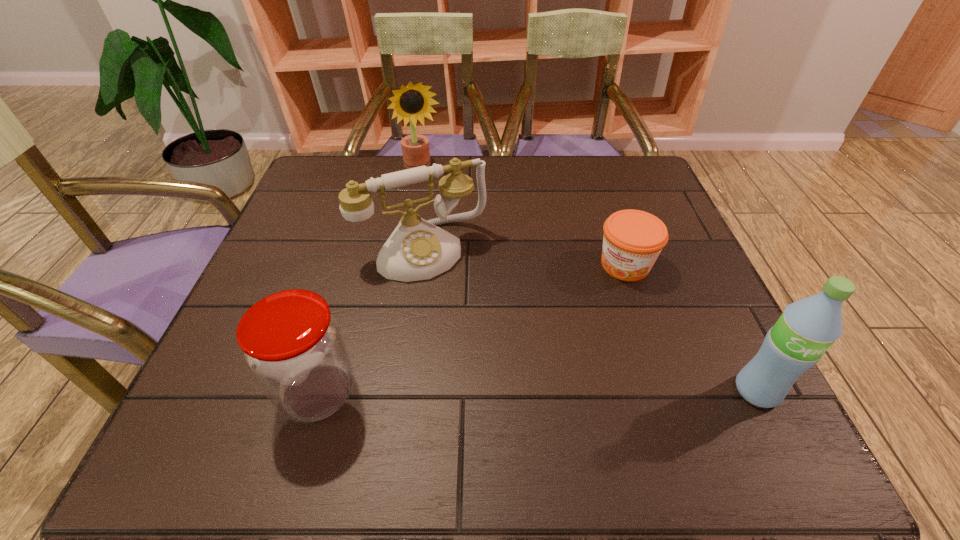
At what (x,y) coordinates should I click in order to perform the action: click on vacant region between the water bottle and the telephone. Please return your answer as a coordinate pair (x, y). This screenshot has height=540, width=960. Looking at the image, I should click on (589, 320).

Point out which object is positioned as the fourth nearest to the second object from right to left. Please provide its 2D coordinates. Your answer should be formatted as a tuple, i.e. [(x, y)], where the tuple contains the x and y coordinates of a point satisfying the conditions above.

[(293, 345)]

At what (x,y) coordinates should I click in order to perform the action: click on the third closest object relative to the telephone. Please return your answer as a coordinate pair (x, y). This screenshot has height=540, width=960. Looking at the image, I should click on (633, 239).

At what (x,y) coordinates should I click in order to perform the action: click on vacant space that satisfies the following two spatial constraints: 1. on the front side of the telephone; 2. on the right side of the water bottle. Please return your answer as a coordinate pair (x, y). The width and height of the screenshot is (960, 540). Looking at the image, I should click on (402, 391).